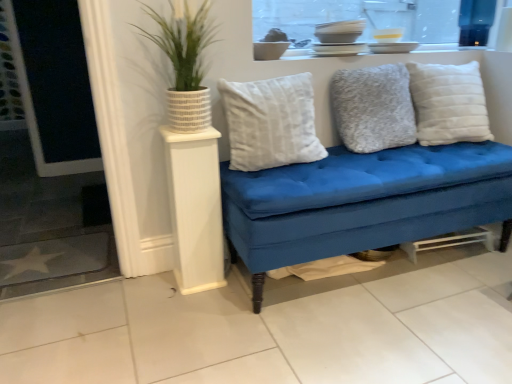
Question: Considering the relative positions of white textured pillow at right, which is the third pillow in left-to-right order, and fuzzy gray pillow at center, marked as the second pillow in a left-to-right arrangement, in the image provided, is white textured pillow at right, which is the third pillow in left-to-right order, in front of fuzzy gray pillow at center, marked as the second pillow in a left-to-right arrangement,?

Choices:
 (A) no
 (B) yes

Answer: (A)

Question: From a real-world perspective, does white textured pillow at right, the 1th pillow in the right-to-left sequence, stand above fuzzy gray pillow at center, marked as the second pillow in a left-to-right arrangement?

Choices:
 (A) no
 (B) yes

Answer: (A)

Question: From a real-world perspective, is white textured pillow at right, which is the third pillow in left-to-right order, below fuzzy gray pillow at center, marked as the second pillow in a left-to-right arrangement?

Choices:
 (A) yes
 (B) no

Answer: (A)

Question: Considering the relative sizes of white textured pillow at right, which is the third pillow in left-to-right order, and fuzzy gray pillow at center, which is the second pillow from right to left, in the image provided, is white textured pillow at right, which is the third pillow in left-to-right order, taller than fuzzy gray pillow at center, which is the second pillow from right to left,?

Choices:
 (A) yes
 (B) no

Answer: (A)

Question: Is white textured pillow at right, the 1th pillow in the right-to-left sequence, next to fuzzy gray pillow at center, which is the second pillow from right to left?

Choices:
 (A) yes
 (B) no

Answer: (B)

Question: Can we say white textured pillow at right, which is the third pillow in left-to-right order, lies outside fuzzy gray pillow at center, which is the second pillow from right to left?

Choices:
 (A) no
 (B) yes

Answer: (B)

Question: Does white plush pillow at center, the first pillow in the left-to-right sequence, appear on the right side of white textured pillow at right, which is the third pillow in left-to-right order?

Choices:
 (A) no
 (B) yes

Answer: (A)

Question: Could white textured pillow at right, which is the third pillow in left-to-right order, be considered to be inside white plush pillow at center, placed as the 3th pillow when sorted from right to left?

Choices:
 (A) no
 (B) yes

Answer: (A)

Question: Considering the relative sizes of white plush pillow at center, the first pillow in the left-to-right sequence, and white textured pillow at right, which is the third pillow in left-to-right order, in the image provided, is white plush pillow at center, the first pillow in the left-to-right sequence, smaller than white textured pillow at right, which is the third pillow in left-to-right order,?

Choices:
 (A) no
 (B) yes

Answer: (B)

Question: From a real-world perspective, does white plush pillow at center, the first pillow in the left-to-right sequence, stand above white textured pillow at right, the 1th pillow in the right-to-left sequence?

Choices:
 (A) yes
 (B) no

Answer: (A)

Question: Does white plush pillow at center, the first pillow in the left-to-right sequence, lie behind white textured pillow at right, which is the third pillow in left-to-right order?

Choices:
 (A) no
 (B) yes

Answer: (A)

Question: Could you tell me if white plush pillow at center, placed as the 3th pillow when sorted from right to left, is turned towards white textured pillow at right, the 1th pillow in the right-to-left sequence?

Choices:
 (A) no
 (B) yes

Answer: (A)

Question: Is white textured pillow at right, which is the third pillow in left-to-right order, placed right next to white wood side table at left?

Choices:
 (A) yes
 (B) no

Answer: (B)